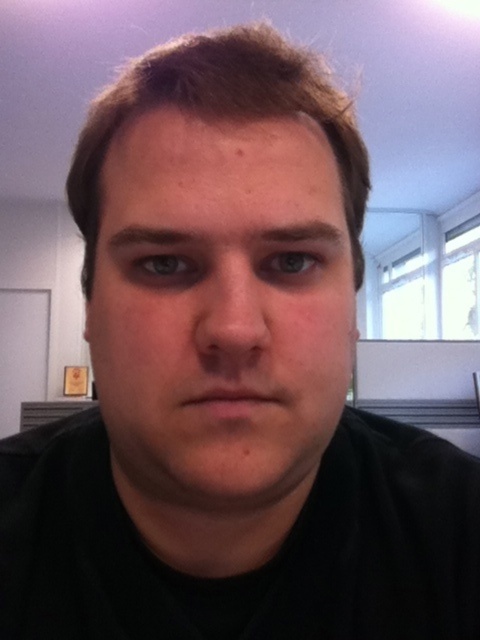
Is point (333, 124) positioned before point (289, 237)?

No, it is behind (289, 237).

Does brown matte hair at center appear over dark brown hair at center?

Yes, brown matte hair at center is above dark brown hair at center.

Measure the distance between point [188,106] and camera.

Result: Point [188,106] is 10.45 inches from camera.

Locate an element on the screen. The image size is (480, 640). brown matte hair at center is located at coordinates (220, 113).

Consider the image. Can you confirm if matte skin nose at center is thinner than dark brown eyebrow at upper center?

Yes.

Which is behind, point (205, 296) or point (203, 236)?

The point (205, 296) is more distant.

What do you see at coordinates (231, 305) in the screenshot? Image resolution: width=480 pixels, height=640 pixels. I see `matte skin nose at center` at bounding box center [231, 305].

This screenshot has width=480, height=640. I want to click on matte skin nose at center, so (231, 305).

Which of these two, matte skin nose at center or dark brown hair at center, stands taller?

matte skin nose at center

Does matte skin nose at center have a greater width compared to dark brown hair at center?

Incorrect, matte skin nose at center's width does not surpass dark brown hair at center's.

Is point (214, 346) closer to camera compared to point (286, 241)?

Yes, it is.

You are a GUI agent. You are given a task and a screenshot of the screen. Output one action in this format:
    pyautogui.click(x=<x>, y=<y>)
    Task: Click on the matte skin nose at center
    This screenshot has height=640, width=480.
    Given the screenshot: What is the action you would take?
    pyautogui.click(x=231, y=305)